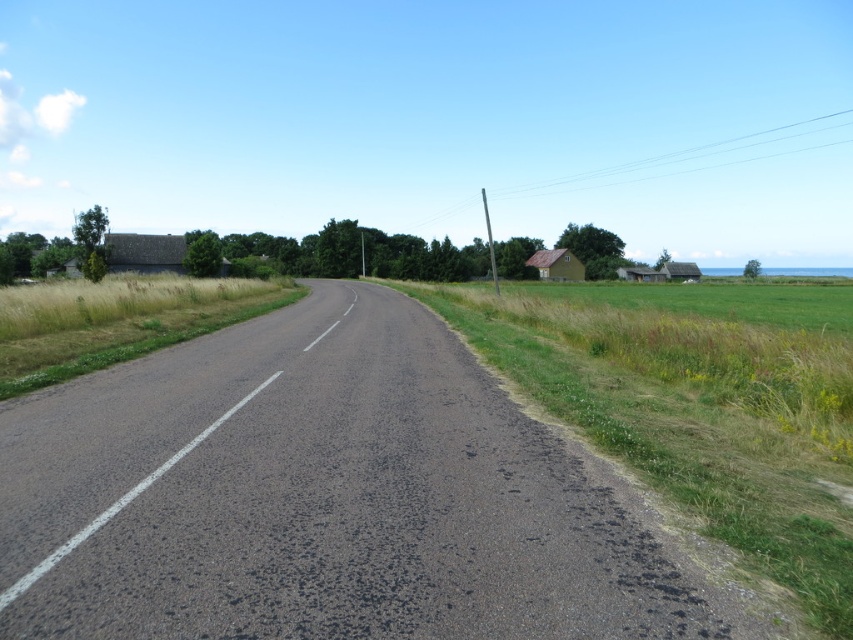
You are standing at the point labeled point [19,316] and want to walk towards the point labeled point [587,384]. Given that you can only move along the road, which direction should you face to reach your destination?

You should face towards the direction where the road curves to the left in the distance because point [587,384] is closer to the camera than point [19,316], indicating it is located further along the road in that direction.